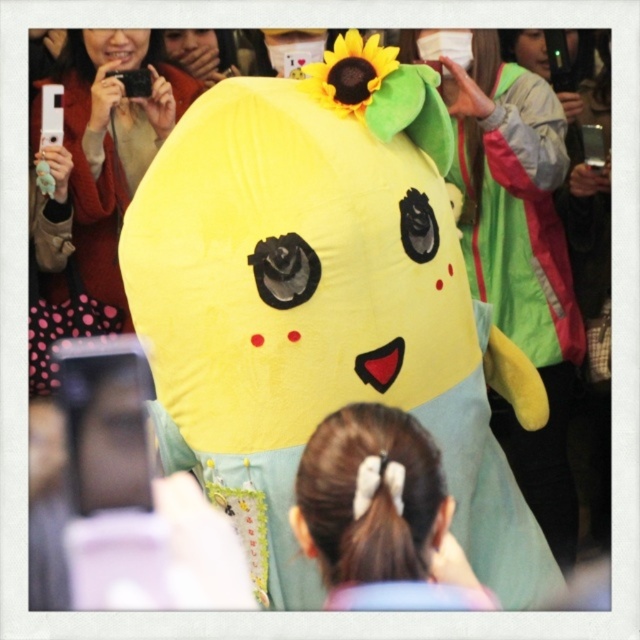
Which is behind, point (337, 557) or point (83, 204)?

The point (83, 204) is more distant.

This screenshot has width=640, height=640. Find the location of `white fabric ponytail at center`. white fabric ponytail at center is located at coordinates (380, 515).

Does smooth skin face at upper left have a lesser height compared to matte yellow plush at center?

Yes.

Is smooth skin face at upper left in front of matte yellow plush at center?

Yes, it is.

Does point (132, 67) come in front of point (525, 65)?

Yes.

The image size is (640, 640). I want to click on smooth skin face at upper left, so click(x=115, y=48).

Image resolution: width=640 pixels, height=640 pixels. Describe the element at coordinates (380, 515) in the screenshot. I see `white fabric ponytail at center` at that location.

Between point (310, 529) and point (177, 35), which one is positioned in front?

Point (310, 529) is more forward.

Where is `white fabric ponytail at center`? The height and width of the screenshot is (640, 640). white fabric ponytail at center is located at coordinates (380, 515).